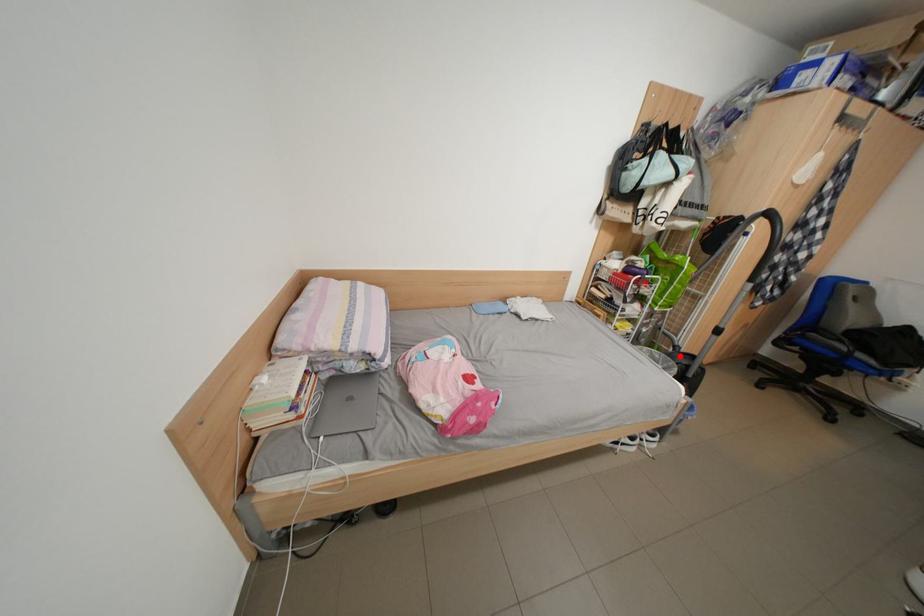
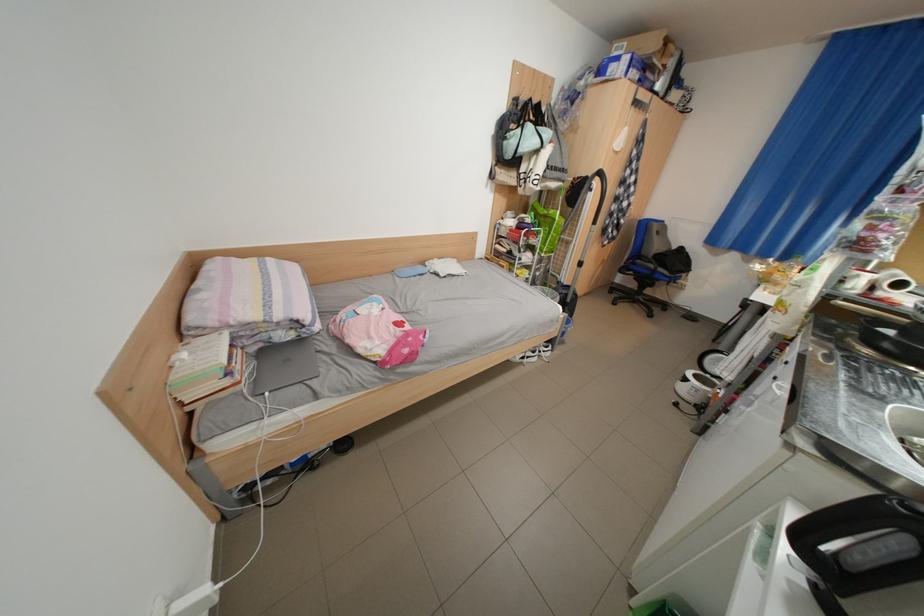
Question: I am providing you with two images of the same scene from different viewpoints. Given a red point in image1, look at the same physical point in image2. Is it:

Choices:
 (A) Closer to the viewpoint
 (B) Farther from the viewpoint

Answer: (B)